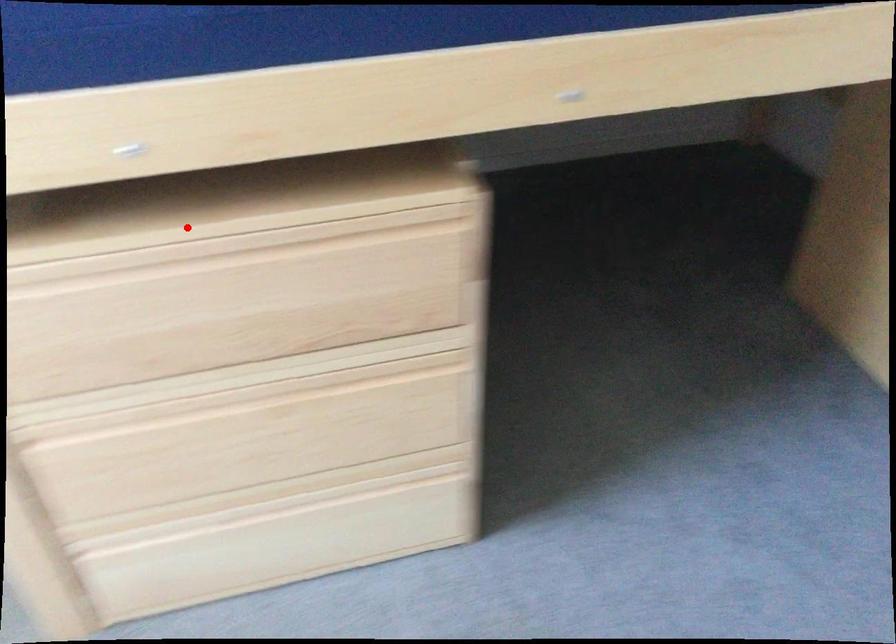
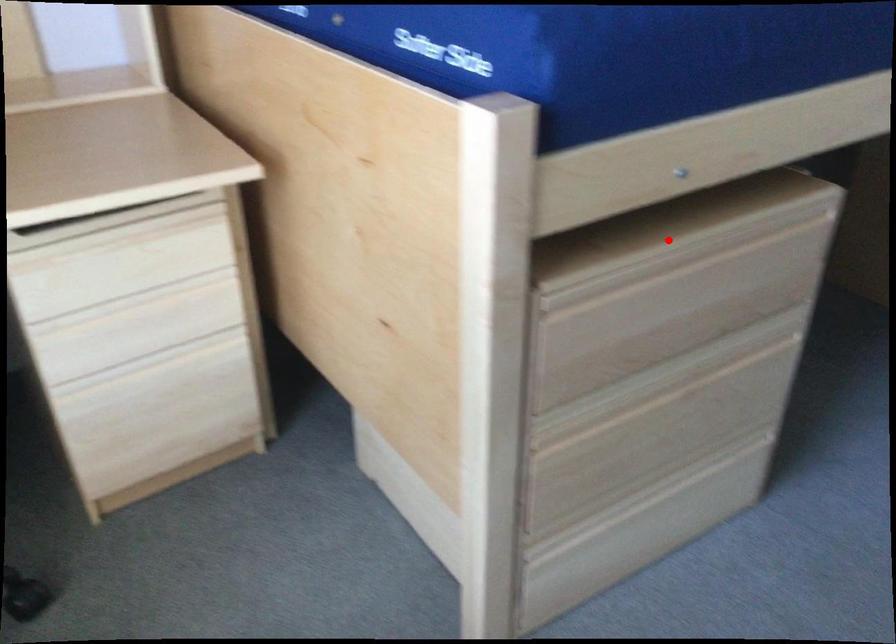
I am providing you with two images of the same scene from different viewpoints. A red point is marked on the first image and another point is marked on the second image. Is the red point in image1 aligned with the point shown in image2?

Yes